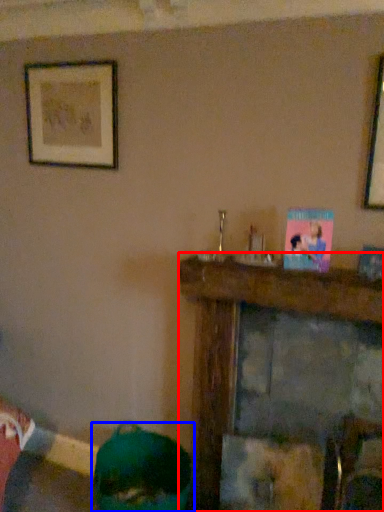
Question: Among these objects, which one is farthest to the camera, furniture (highlighted by a red box) or person (highlighted by a blue box)?

Choices:
 (A) furniture
 (B) person

Answer: (B)